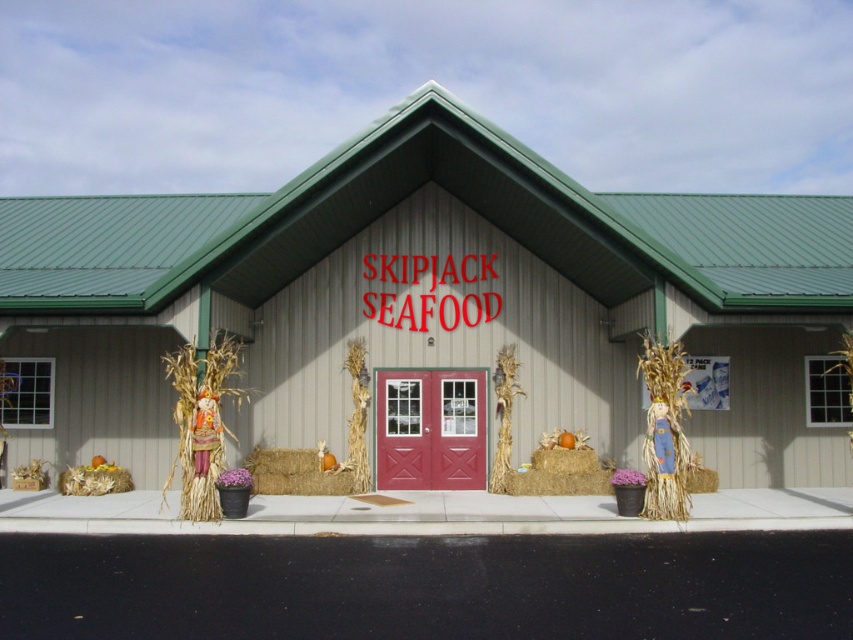
You are standing at the entrance of the building and want to place a new potted plant with purple flowers. The existing potted plants are already on the sidewalk on both sides of the entrance. Where should you place the new potted plant so it is closest to the bleached straw bale at center?

The bleached straw bale at center is located at point (294,472). To place the new potted plant closest to it, position it near the existing potted plants on the sidewalk closest to the bleached straw bale at center.

You are a gardener who needs to place a new potted plant between the yellow straw bale at lower left and the braided straw hay at lower right. Which side of the path should you choose to ensure the plant has enough space to grow?

The yellow straw bale at lower left has a larger width than the braided straw hay at lower right, so placing the potted plant on the side of the yellow straw bale at lower left would provide more space for the plant to grow.